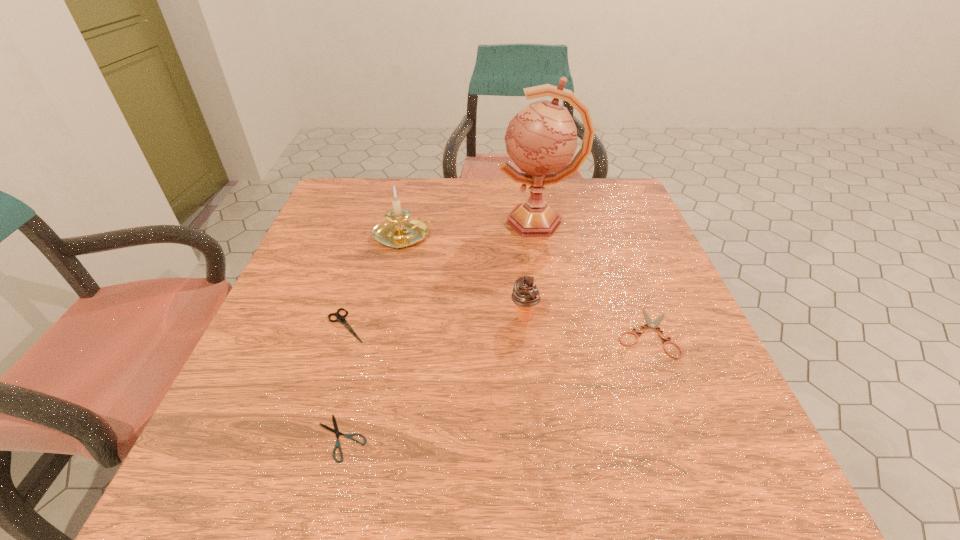
What are the coordinates of `free location that satisfies the following two spatial constraints: 1. on the front-facing side of the tallest object; 2. on the back side of the second shortest shears` in the screenshot? It's located at (557, 332).

The image size is (960, 540). In order to click on free space that satisfies the following two spatial constraints: 1. on the front-facing side of the tallest object; 2. on the front side of the nearest object in this screenshot , I will do `click(576, 438)`.

Locate an element on the screen. free space that satisfies the following two spatial constraints: 1. on the handle side of the second shortest shears; 2. on the left side of the candle holder is located at coordinates (385, 332).

Where is `vacant region that satisfies the following two spatial constraints: 1. on the front side of the second tallest shears; 2. on the right side of the tallest shears`? vacant region that satisfies the following two spatial constraints: 1. on the front side of the second tallest shears; 2. on the right side of the tallest shears is located at coordinates (345, 332).

At what (x,y) coordinates should I click in order to perform the action: click on free space that satisfies the following two spatial constraints: 1. on the front-facing side of the globe; 2. on the right side of the rightmost object. Please return your answer as a coordinate pair (x, y). Image resolution: width=960 pixels, height=540 pixels. Looking at the image, I should click on pyautogui.click(x=557, y=332).